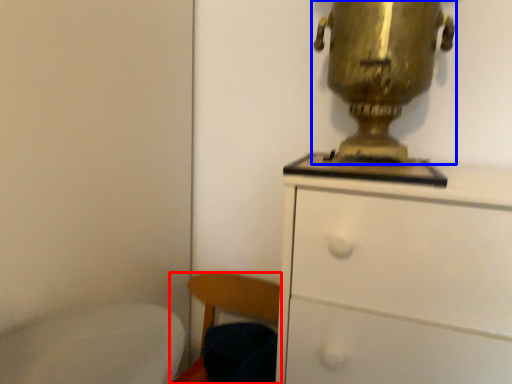
Question: Which point is further to the camera, chair (highlighted by a red box) or table lamp (highlighted by a blue box)?

Choices:
 (A) chair
 (B) table lamp

Answer: (A)